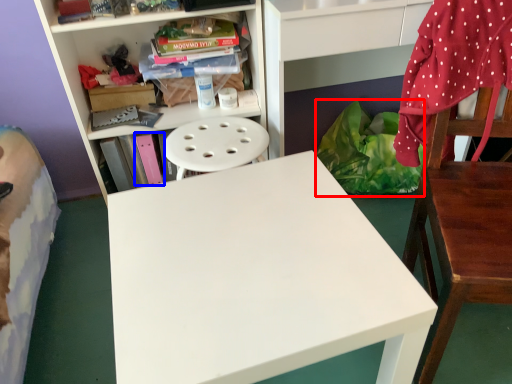
Question: Which object is closer to the camera taking this photo, material (highlighted by a red box) or book (highlighted by a blue box)?

Choices:
 (A) material
 (B) book

Answer: (B)